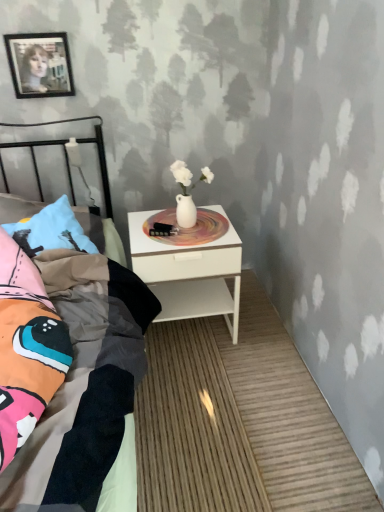
Question: Is black glossy picture frame at upper left located outside multicolored fabric bed at left?

Choices:
 (A) no
 (B) yes

Answer: (B)

Question: Considering the relative sizes of black glossy picture frame at upper left and multicolored fabric bed at left in the image provided, is black glossy picture frame at upper left wider than multicolored fabric bed at left?

Choices:
 (A) yes
 (B) no

Answer: (B)

Question: From a real-world perspective, is black glossy picture frame at upper left physically above multicolored fabric bed at left?

Choices:
 (A) no
 (B) yes

Answer: (B)

Question: Are black glossy picture frame at upper left and multicolored fabric bed at left beside each other?

Choices:
 (A) yes
 (B) no

Answer: (B)

Question: From a real-world perspective, is black glossy picture frame at upper left under multicolored fabric bed at left?

Choices:
 (A) yes
 (B) no

Answer: (B)

Question: Is black glossy picture frame at upper left at the left side of multicolored fabric bed at left?

Choices:
 (A) no
 (B) yes

Answer: (B)

Question: Is multicolored fabric bed at left not inside white glossy nightstand at center?

Choices:
 (A) yes
 (B) no

Answer: (A)

Question: From the image's perspective, is multicolored fabric bed at left on white glossy nightstand at center?

Choices:
 (A) yes
 (B) no

Answer: (B)

Question: From a real-world perspective, is multicolored fabric bed at left located higher than white glossy nightstand at center?

Choices:
 (A) yes
 (B) no

Answer: (A)

Question: From a real-world perspective, is multicolored fabric bed at left under white glossy nightstand at center?

Choices:
 (A) yes
 (B) no

Answer: (B)

Question: Are multicolored fabric bed at left and white glossy nightstand at center making contact?

Choices:
 (A) no
 (B) yes

Answer: (A)

Question: Does multicolored fabric bed at left come behind white glossy nightstand at center?

Choices:
 (A) yes
 (B) no

Answer: (B)

Question: Does black glossy picture frame at upper left have a greater width compared to white glossy nightstand at center?

Choices:
 (A) yes
 (B) no

Answer: (B)